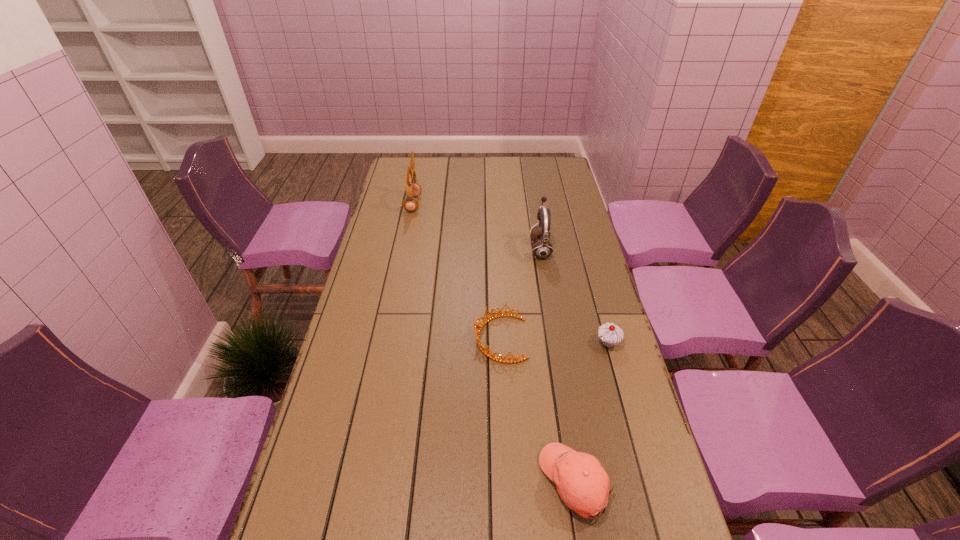
Locate an element on the screen. This screenshot has height=540, width=960. vacant position in the image that satisfies the following two spatial constraints: 1. on the ear pads of the fourth nearest object; 2. on the right side of the cupcake is located at coordinates (556, 343).

Locate an element on the screen. The width and height of the screenshot is (960, 540). free space that satisfies the following two spatial constraints: 1. on the front-facing side of the rightmost object; 2. on the right side of the shortest object is located at coordinates (500, 343).

Find the location of a particular element. Image resolution: width=960 pixels, height=540 pixels. free spot that satisfies the following two spatial constraints: 1. on the back side of the nearest object; 2. on the front-facing side of the tiara is located at coordinates (x=553, y=339).

Locate an element on the screen. The width and height of the screenshot is (960, 540). vacant area that satisfies the following two spatial constraints: 1. on the front-facing side of the nearest object; 2. on the left side of the farthest object is located at coordinates (356, 482).

Where is `blank area in the image that satisfies the following two spatial constraints: 1. on the front-facing side of the baseball cap; 2. on the right side of the leftmost object`? The width and height of the screenshot is (960, 540). blank area in the image that satisfies the following two spatial constraints: 1. on the front-facing side of the baseball cap; 2. on the right side of the leftmost object is located at coordinates (356, 482).